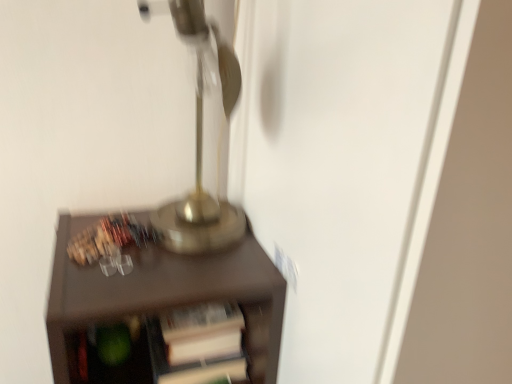
The width and height of the screenshot is (512, 384). Describe the element at coordinates (160, 302) in the screenshot. I see `brown matte cabinet at center` at that location.

Consider the image. What is the approximate width of brown matte cabinet at center?

brown matte cabinet at center is 12.25 inches wide.

Identify the location of brown matte cabinet at center. (160, 302).

Where is `gold metallic table lamp at upper center`? The image size is (512, 384). gold metallic table lamp at upper center is located at coordinates (200, 141).

The width and height of the screenshot is (512, 384). What do you see at coordinates (200, 141) in the screenshot?
I see `gold metallic table lamp at upper center` at bounding box center [200, 141].

Locate an element on the screen. This screenshot has height=384, width=512. brown matte cabinet at center is located at coordinates (160, 302).

Based on the photo, which object is positioned more to the left, gold metallic table lamp at upper center or brown matte cabinet at center?

From the viewer's perspective, brown matte cabinet at center appears more on the left side.

Does gold metallic table lamp at upper center lie in front of brown matte cabinet at center?

Yes, gold metallic table lamp at upper center is in front of brown matte cabinet at center.

Considering the points (170, 234) and (145, 362), which point is behind, point (170, 234) or point (145, 362)?

The point (145, 362) is farther from the camera.

From the image's perspective, is gold metallic table lamp at upper center above brown matte cabinet at center?

Yes, from the image's perspective, gold metallic table lamp at upper center is on top of brown matte cabinet at center.

From a real-world perspective, which object stands above the other?

From a 3D spatial view, gold metallic table lamp at upper center is above.

Between gold metallic table lamp at upper center and brown matte cabinet at center, which one has smaller width?

gold metallic table lamp at upper center is thinner.

Does gold metallic table lamp at upper center have a lesser height compared to brown matte cabinet at center?

Correct, gold metallic table lamp at upper center is not as tall as brown matte cabinet at center.

Is gold metallic table lamp at upper center bigger than brown matte cabinet at center?

Incorrect, gold metallic table lamp at upper center is not larger than brown matte cabinet at center.

Choose the correct answer: Is gold metallic table lamp at upper center inside brown matte cabinet at center or outside it?

gold metallic table lamp at upper center is not inside brown matte cabinet at center, it's outside.

Are gold metallic table lamp at upper center and brown matte cabinet at center making contact?

No, gold metallic table lamp at upper center is not in contact with brown matte cabinet at center.

Is gold metallic table lamp at upper center looking in the opposite direction of brown matte cabinet at center?

That's not correct — gold metallic table lamp at upper center is not looking away from brown matte cabinet at center.

What's the angular difference between gold metallic table lamp at upper center and brown matte cabinet at center's facing directions?

1.46 degrees separate the facing orientations of gold metallic table lamp at upper center and brown matte cabinet at center.

Measure the distance between gold metallic table lamp at upper center and brown matte cabinet at center.

gold metallic table lamp at upper center is 5.53 inches from brown matte cabinet at center.

At what (x,y) coordinates should I click in order to perform the action: click on furniture that appears below the gold metallic table lamp at upper center (from a real-world perspective). Please return your answer as a coordinate pair (x, y). The height and width of the screenshot is (384, 512). Looking at the image, I should click on (160, 302).

Considering the relative positions of brown matte cabinet at center and gold metallic table lamp at upper center in the image provided, is brown matte cabinet at center to the right of gold metallic table lamp at upper center from the viewer's perspective?

Incorrect, brown matte cabinet at center is not on the right side of gold metallic table lamp at upper center.

Which object is closer to the camera taking this photo, brown matte cabinet at center or gold metallic table lamp at upper center?

gold metallic table lamp at upper center.

Which is less distant, (219, 272) or (226, 54)?

The point (226, 54) is closer to the camera.

From the picture: From the image's perspective, is brown matte cabinet at center under gold metallic table lamp at upper center?

Yes, from the image's perspective, brown matte cabinet at center is below gold metallic table lamp at upper center.

From a real-world perspective, is brown matte cabinet at center located beneath gold metallic table lamp at upper center?

Correct, in the physical world, brown matte cabinet at center is lower than gold metallic table lamp at upper center.

Which of these two, brown matte cabinet at center or gold metallic table lamp at upper center, is thinner?

Thinner between the two is gold metallic table lamp at upper center.

Is brown matte cabinet at center shorter than gold metallic table lamp at upper center?

No.

In terms of size, does brown matte cabinet at center appear bigger or smaller than gold metallic table lamp at upper center?

Clearly, brown matte cabinet at center is larger in size than gold metallic table lamp at upper center.

Is brown matte cabinet at center not inside gold metallic table lamp at upper center?

brown matte cabinet at center lies outside gold metallic table lamp at upper center's area.

Is brown matte cabinet at center next to gold metallic table lamp at upper center and touching it?

brown matte cabinet at center and gold metallic table lamp at upper center are clearly separated.

Is brown matte cabinet at center positioned with its back to gold metallic table lamp at upper center?

brown matte cabinet at center is not turned away from gold metallic table lamp at upper center.

This screenshot has width=512, height=384. Find the location of `table lamp located above the brown matte cabinet at center (from a real-world perspective)`. table lamp located above the brown matte cabinet at center (from a real-world perspective) is located at coordinates (200, 141).

Identify the location of furniture lying below the gold metallic table lamp at upper center (from the image's perspective). (160, 302).

Find the location of a particular element. The width and height of the screenshot is (512, 384). furniture below the gold metallic table lamp at upper center (from a real-world perspective) is located at coordinates (160, 302).